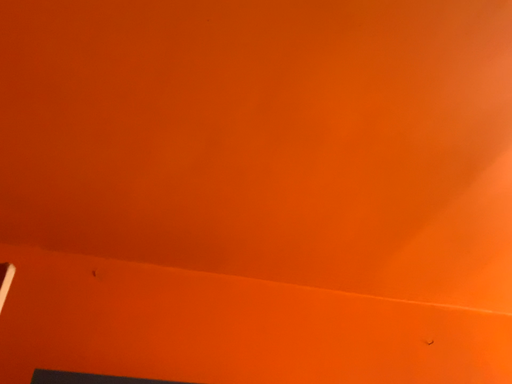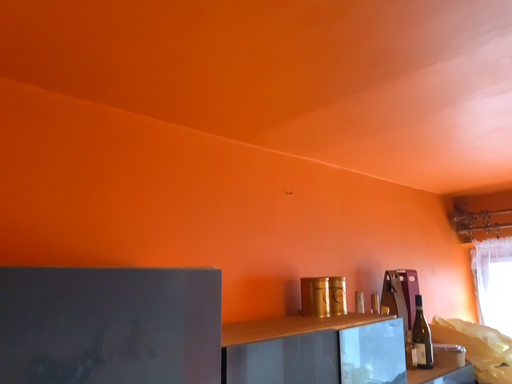
Question: Which way did the camera rotate in the video?

Choices:
 (A) rotated downward
 (B) rotated upward

Answer: (A)